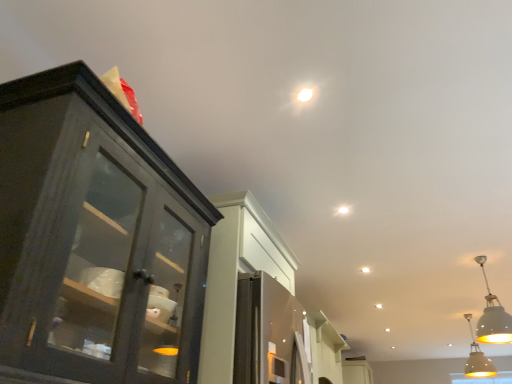
Question: Considering the relative positions of white matte droplight at upper center and matte yellow pendant light at lower right, the second light fixture when ordered from left to right, in the image provided, is white matte droplight at upper center to the right of matte yellow pendant light at lower right, the second light fixture when ordered from left to right, from the viewer's perspective?

Choices:
 (A) no
 (B) yes

Answer: (A)

Question: From the image's perspective, is white matte droplight at upper center located above matte yellow pendant light at lower right, positioned as the 2th light fixture in front-to-back order?

Choices:
 (A) yes
 (B) no

Answer: (A)

Question: Is white matte droplight at upper center shorter than matte yellow pendant light at lower right, the second light fixture when ordered from left to right?

Choices:
 (A) no
 (B) yes

Answer: (B)

Question: Is white matte droplight at upper center positioned with its back to matte yellow pendant light at lower right, positioned as the 2th light fixture in front-to-back order?

Choices:
 (A) no
 (B) yes

Answer: (A)

Question: Is white matte droplight at upper center bigger than matte yellow pendant light at lower right, the first light fixture when ordered from bottom to top?

Choices:
 (A) no
 (B) yes

Answer: (A)

Question: Is white matte droplight at upper center to the left of matte yellow pendant light at lower right, positioned as the 2th light fixture in front-to-back order, from the viewer's perspective?

Choices:
 (A) yes
 (B) no

Answer: (A)

Question: Is white matte droplight at upper center at the left side of white matte cabinet at center?

Choices:
 (A) no
 (B) yes

Answer: (B)

Question: Is the depth of white matte droplight at upper center less than that of white matte cabinet at center?

Choices:
 (A) no
 (B) yes

Answer: (B)

Question: Considering the relative sizes of white matte droplight at upper center and white matte cabinet at center in the image provided, is white matte droplight at upper center shorter than white matte cabinet at center?

Choices:
 (A) no
 (B) yes

Answer: (B)

Question: Considering the relative sizes of white matte droplight at upper center and white matte cabinet at center in the image provided, is white matte droplight at upper center wider than white matte cabinet at center?

Choices:
 (A) no
 (B) yes

Answer: (A)

Question: Is white matte droplight at upper center positioned behind white matte cabinet at center?

Choices:
 (A) yes
 (B) no

Answer: (B)

Question: From a real-world perspective, is white matte droplight at upper center beneath white matte cabinet at center?

Choices:
 (A) no
 (B) yes

Answer: (A)

Question: Does white matte pendant light at lower right, which appears as the 2th light fixture when viewed from the back, have a greater width compared to white matte droplight at upper center?

Choices:
 (A) no
 (B) yes

Answer: (B)